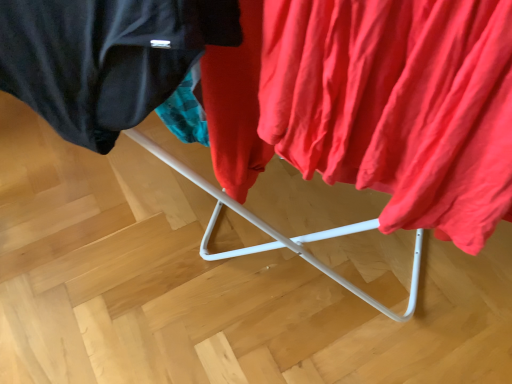
The image size is (512, 384). In order to click on vacant space underneath matte red fabric at right (from a real-world perspective) in this screenshot , I will do `click(325, 331)`.